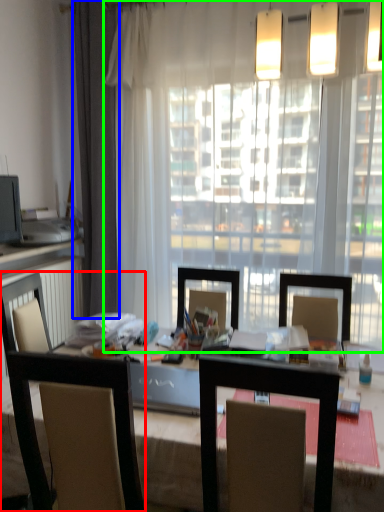
Question: Based on their relative distances, which object is farther from chair (highlighted by a red box)? Choose from curtain (highlighted by a blue box) and window (highlighted by a green box).

Choices:
 (A) curtain
 (B) window

Answer: (A)